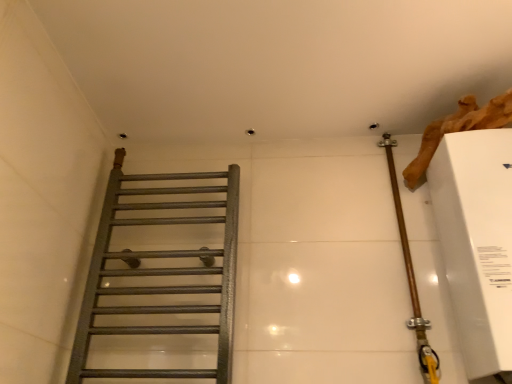
Image resolution: width=512 pixels, height=384 pixels. What do you see at coordinates (161, 281) in the screenshot? I see `matte gray towel rack at left` at bounding box center [161, 281].

You are a GUI agent. You are given a task and a screenshot of the screen. Output one action in this format:
    pyautogui.click(x=<x>, y=<y>)
    Task: Click on the matte gray towel rack at left
    The image size is (512, 384).
    Given the screenshot: What is the action you would take?
    pyautogui.click(x=161, y=281)

You are a GUI agent. You are given a task and a screenshot of the screen. Output one action in this format:
    pyautogui.click(x=<x>, y=<y>)
    Task: Click on the matte gray towel rack at left
    
    Given the screenshot: What is the action you would take?
    pyautogui.click(x=161, y=281)